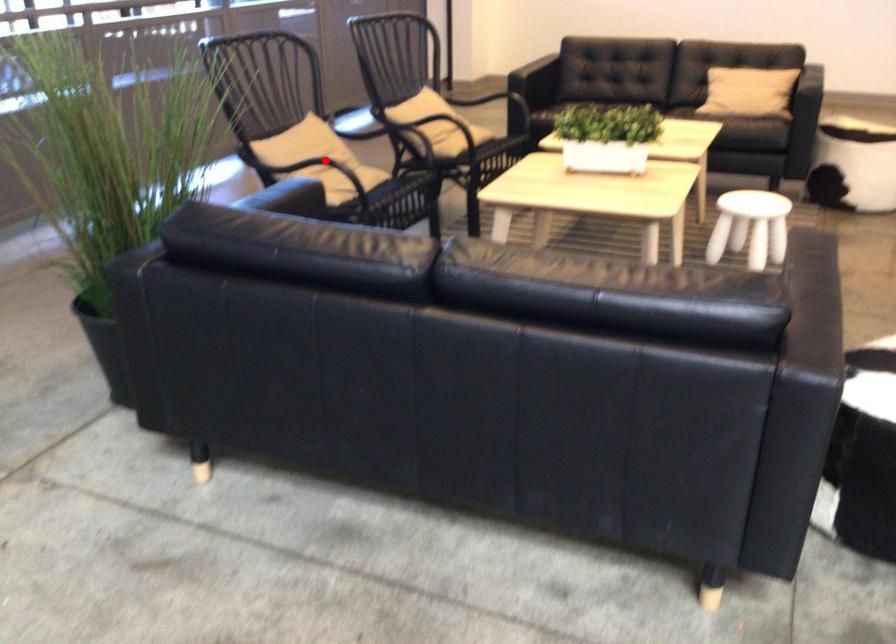
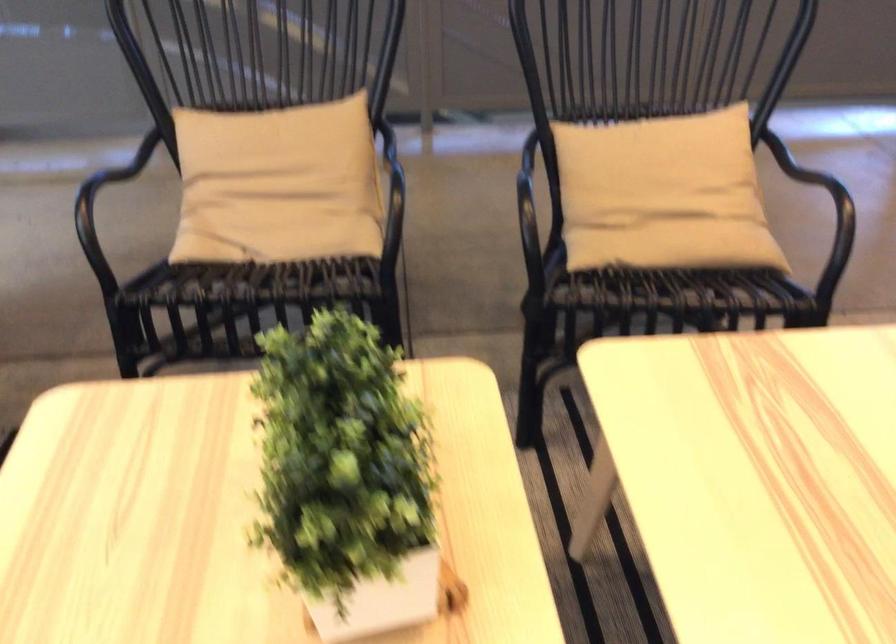
Find the pixel in the second image that matches the highlighted location in the first image.

(278, 184)